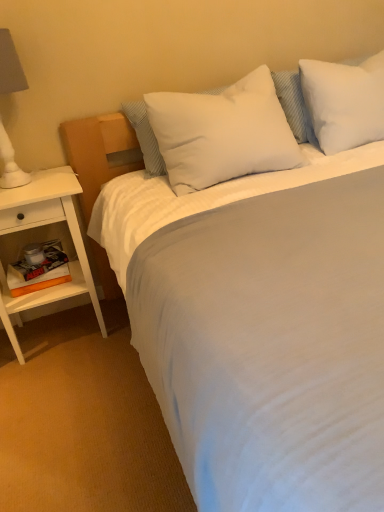
Locate an element on the screen. vacant space in front of white wood nightstand at left is located at coordinates (60, 388).